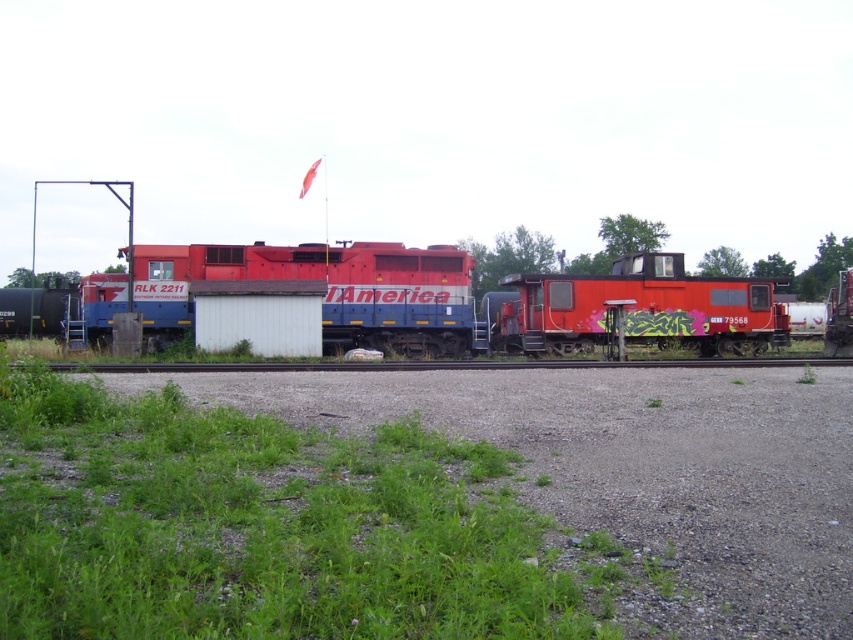
Between matte red train at center and shiny red train car at center, which one is positioned lower?

shiny red train car at center

Is matte red train at center thinner than shiny red train car at center?

No.

Between point (630, 323) and point (720, 332), which one is positioned in front?

Positioned in front is point (630, 323).

Find the location of `matte red train at center`. matte red train at center is located at coordinates (421, 300).

Does shiny red train car at center appear on the right side of black asphalt train track at center?

Correct, you'll find shiny red train car at center to the right of black asphalt train track at center.

From the picture: Who is taller, shiny red train car at center or black asphalt train track at center?

shiny red train car at center is taller.

Identify the location of shiny red train car at center. (637, 308).

At what (x,y) coordinates should I click in order to perform the action: click on shiny red train car at center. Please return your answer as a coordinate pair (x, y). This screenshot has height=640, width=853. Looking at the image, I should click on (637, 308).

Does matte red train at center have a smaller size compared to black asphalt train track at center?

No, matte red train at center is not smaller than black asphalt train track at center.

Which is behind, point (222, 244) or point (436, 360)?

Positioned behind is point (222, 244).

I want to click on matte red train at center, so click(x=421, y=300).